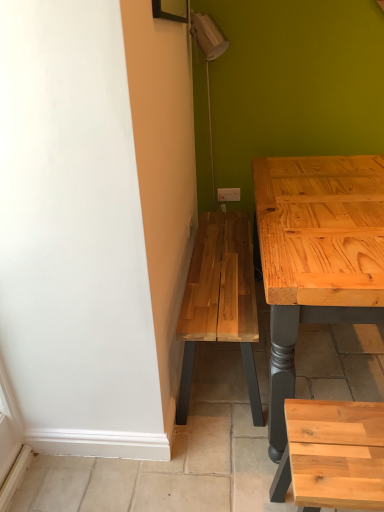
Question: Can you confirm if natural wood stool at lower right is thinner than white plastic electric outlet at upper center?

Choices:
 (A) yes
 (B) no

Answer: (B)

Question: Considering the relative sizes of natural wood stool at lower right and white plastic electric outlet at upper center in the image provided, is natural wood stool at lower right bigger than white plastic electric outlet at upper center?

Choices:
 (A) no
 (B) yes

Answer: (B)

Question: From the image's perspective, is natural wood stool at lower right below white plastic electric outlet at upper center?

Choices:
 (A) yes
 (B) no

Answer: (A)

Question: Does natural wood stool at lower right lie behind white plastic electric outlet at upper center?

Choices:
 (A) yes
 (B) no

Answer: (B)

Question: Can you confirm if natural wood stool at lower right is positioned to the right of white plastic electric outlet at upper center?

Choices:
 (A) yes
 (B) no

Answer: (A)

Question: Does natural wood stool at lower right turn towards white plastic electric outlet at upper center?

Choices:
 (A) no
 (B) yes

Answer: (A)

Question: From a real-world perspective, is white plastic electric outlet at upper center beneath natural wood stool at lower right?

Choices:
 (A) no
 (B) yes

Answer: (A)

Question: Considering the relative sizes of white plastic electric outlet at upper center and natural wood stool at lower right in the image provided, is white plastic electric outlet at upper center wider than natural wood stool at lower right?

Choices:
 (A) yes
 (B) no

Answer: (B)

Question: Does white plastic electric outlet at upper center lie behind natural wood stool at lower right?

Choices:
 (A) no
 (B) yes

Answer: (B)

Question: Is white plastic electric outlet at upper center closer to camera compared to natural wood stool at lower right?

Choices:
 (A) yes
 (B) no

Answer: (B)

Question: From the image's perspective, does white plastic electric outlet at upper center appear lower than natural wood stool at lower right?

Choices:
 (A) no
 (B) yes

Answer: (A)

Question: From the image's perspective, is white plastic electric outlet at upper center located above natural wood stool at lower right?

Choices:
 (A) yes
 (B) no

Answer: (A)

Question: Visually, is white plastic electric outlet at upper center positioned to the left or to the right of natural wood stool at lower right?

Choices:
 (A) right
 (B) left

Answer: (B)